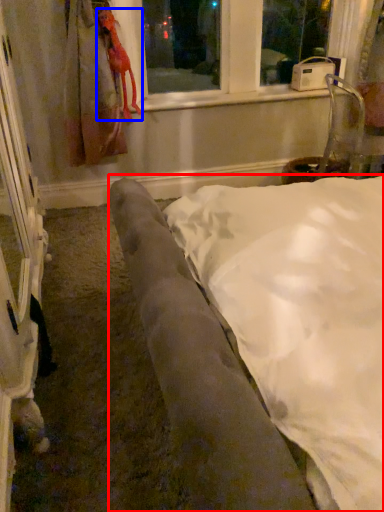
Question: Which object appears farthest to the camera in this image, furniture (highlighted by a red box) or animal (highlighted by a blue box)?

Choices:
 (A) furniture
 (B) animal

Answer: (B)